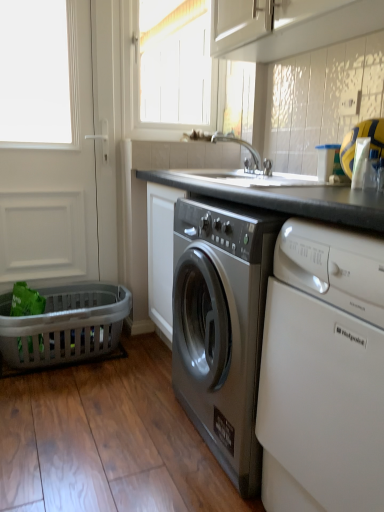
This screenshot has width=384, height=512. I want to click on spots to the right of gray plastic laundry basket at lower left, so click(x=144, y=369).